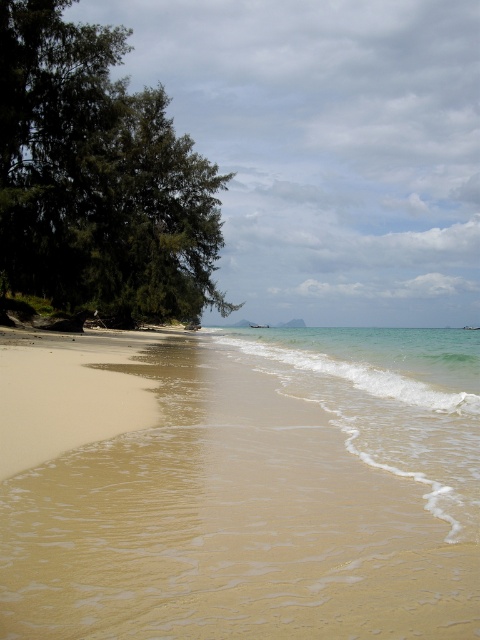
You are standing on the sandy beach at lower left and want to reach the clear water at lower right. Based on the scene, which area is narrower between the two?

The sandy beach at lower left is narrower than the clear water at lower right because it has a lesser width compared to the clear water at lower right.